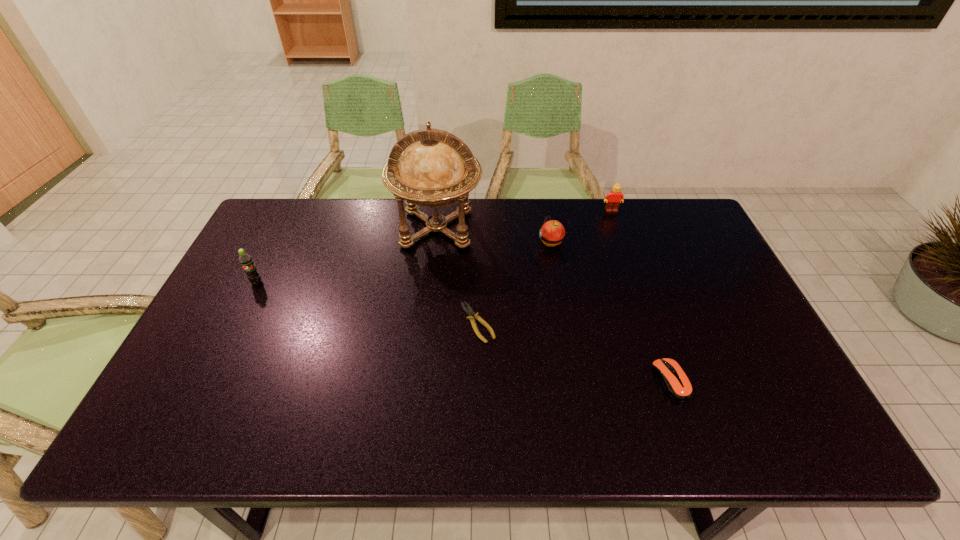
Where is `vacant space located 0.290m on the front-facing side of the globe`? vacant space located 0.290m on the front-facing side of the globe is located at coordinates (425, 333).

You are a GUI agent. You are given a task and a screenshot of the screen. Output one action in this format:
    pyautogui.click(x=<x>, y=<y>)
    Task: Click on the vacant position located on the front label of the leftmost object
    Image resolution: width=960 pixels, height=540 pixels.
    Given the screenshot: What is the action you would take?
    pyautogui.click(x=203, y=391)

The height and width of the screenshot is (540, 960). Identify the location of vacant space located on the face of the Lego. (638, 288).

This screenshot has height=540, width=960. Identify the location of vacant region located on the right of the apple. (684, 242).

In order to click on free space located on the left of the second shortest object in this screenshot , I will do `click(530, 381)`.

At what (x,y) coordinates should I click in order to perform the action: click on vacant space situated on the right of the shortest object. Please return your answer as a coordinate pair (x, y). Image resolution: width=960 pixels, height=540 pixels. Looking at the image, I should click on (533, 323).

Locate an element on the screen. The width and height of the screenshot is (960, 540). globe located at the far edge is located at coordinates (437, 169).

You are a GUI agent. You are given a task and a screenshot of the screen. Output one action in this format:
    pyautogui.click(x=<x>, y=<y>)
    Task: Click on the Lego that is at the far edge
    
    Given the screenshot: What is the action you would take?
    pyautogui.click(x=613, y=199)

Where is `apple that is positioned at the far edge`? Image resolution: width=960 pixels, height=540 pixels. apple that is positioned at the far edge is located at coordinates tap(552, 233).

Find the location of a particular element. object present at the left edge is located at coordinates (245, 260).